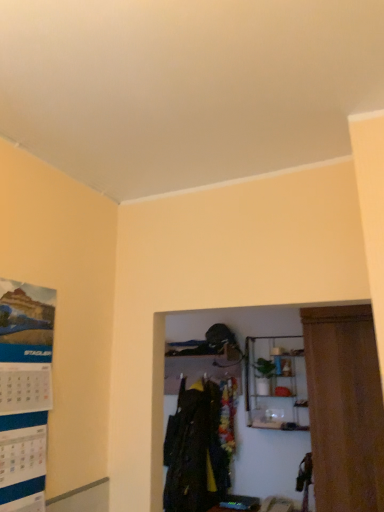
Question: Considering the relative sizes of metallic wire shelf at upper center and matte paper poster at left in the image provided, is metallic wire shelf at upper center thinner than matte paper poster at left?

Choices:
 (A) no
 (B) yes

Answer: (A)

Question: Is metallic wire shelf at upper center surrounding matte paper poster at left?

Choices:
 (A) no
 (B) yes

Answer: (A)

Question: From the image's perspective, is metallic wire shelf at upper center on matte paper poster at left?

Choices:
 (A) yes
 (B) no

Answer: (B)

Question: From a real-world perspective, is metallic wire shelf at upper center located higher than matte paper poster at left?

Choices:
 (A) yes
 (B) no

Answer: (B)

Question: Considering the relative positions of metallic wire shelf at upper center and matte paper poster at left in the image provided, is metallic wire shelf at upper center to the right of matte paper poster at left from the viewer's perspective?

Choices:
 (A) no
 (B) yes

Answer: (B)

Question: Is metallic wire shelf at upper center inside or outside of matte paper poster at left?

Choices:
 (A) inside
 (B) outside

Answer: (B)

Question: Does point (266, 348) appear closer or farther from the camera than point (11, 510)?

Choices:
 (A) closer
 (B) farther

Answer: (B)

Question: In the image, is metallic wire shelf at upper center on the left side or the right side of matte paper poster at left?

Choices:
 (A) right
 (B) left

Answer: (A)

Question: Considering the positions of metallic wire shelf at upper center and matte paper poster at left in the image, is metallic wire shelf at upper center wider or thinner than matte paper poster at left?

Choices:
 (A) thin
 (B) wide

Answer: (B)

Question: Considering the positions of dark green fabric coat at center and metallic wire shelf at upper center in the image, is dark green fabric coat at center wider or thinner than metallic wire shelf at upper center?

Choices:
 (A) wide
 (B) thin

Answer: (B)

Question: Considering the positions of point [193, 505] and point [296, 429], is point [193, 505] closer or farther from the camera than point [296, 429]?

Choices:
 (A) farther
 (B) closer

Answer: (B)

Question: Considering the positions of dark green fabric coat at center and metallic wire shelf at upper center in the image, is dark green fabric coat at center bigger or smaller than metallic wire shelf at upper center?

Choices:
 (A) big
 (B) small

Answer: (A)

Question: In the image, is dark green fabric coat at center positioned in front of or behind metallic wire shelf at upper center?

Choices:
 (A) behind
 (B) front

Answer: (A)

Question: Is point (205, 441) closer or farther from the camera than point (8, 401)?

Choices:
 (A) farther
 (B) closer

Answer: (A)

Question: Considering the positions of dark green fabric coat at center and matte paper poster at left in the image, is dark green fabric coat at center wider or thinner than matte paper poster at left?

Choices:
 (A) thin
 (B) wide

Answer: (B)